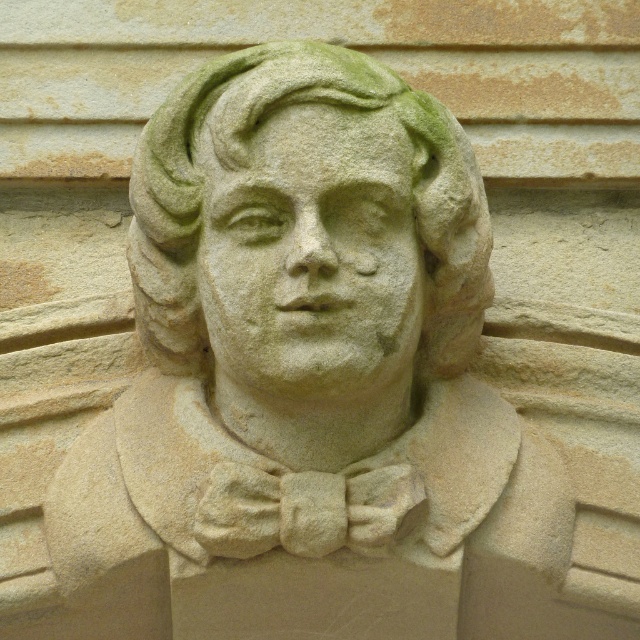
Which is in front, point (227, 234) or point (467, 250)?

Point (227, 234) is more forward.

I want to click on green stone face at center, so click(314, 257).